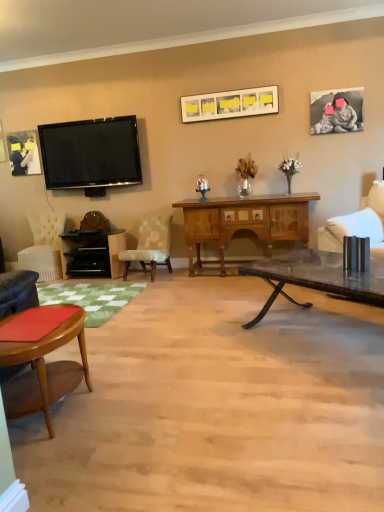
Question: From the image's perspective, is wooden cabinet at center positioned above or below matte black picture frame at upper left, which ranks as the 1th picture frame in back-to-front order?

Choices:
 (A) above
 (B) below

Answer: (B)

Question: In the image, is wooden cabinet at center on the left side or the right side of matte black picture frame at upper left, which ranks as the 1th picture frame in back-to-front order?

Choices:
 (A) right
 (B) left

Answer: (A)

Question: Which of these objects is positioned closest to the black matte photo frame at upper right, acting as the first picture frame starting from the right?

Choices:
 (A) patterned fabric chair at center, placed as the second chair when sorted from right to left
 (B) flat screen tv at upper left
 (C) matte black picture frame at upper left, which ranks as the 1th picture frame in back-to-front order
 (D) wooden cabinet at center
 (E) velvet white chair at left, the 1th chair from the back

Answer: (D)

Question: Estimate the real-world distances between objects in this image. Which object is farther from the matte white picture frame at upper center, which is the second picture frame from front to back?

Choices:
 (A) black matte photo frame at upper right, which is the 1th picture frame from front to back
 (B) matte black picture frame at upper left, the 1th picture frame in the left-to-right sequence
 (C) patterned fabric chair at center, placed as the second chair when sorted from right to left
 (D) white fabric chair at right, the third chair when ordered from back to front
 (E) transparent glass coffee table at center

Answer: (B)